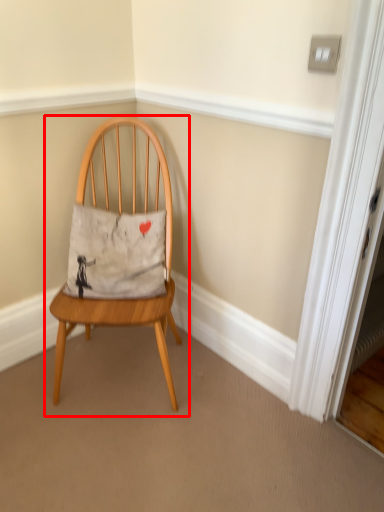
Question: From the image's perspective, considering the relative positions of chair (annotated by the red box) and pillow in the image provided, where is chair (annotated by the red box) located with respect to the staircase?

Choices:
 (A) below
 (B) above

Answer: (A)